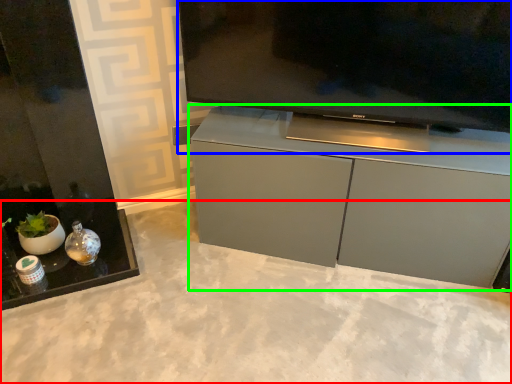
Question: Which is nearer to the concrete (highlighted by a red box)? television (highlighted by a blue box) or cabinetry (highlighted by a green box).

Choices:
 (A) television
 (B) cabinetry

Answer: (B)